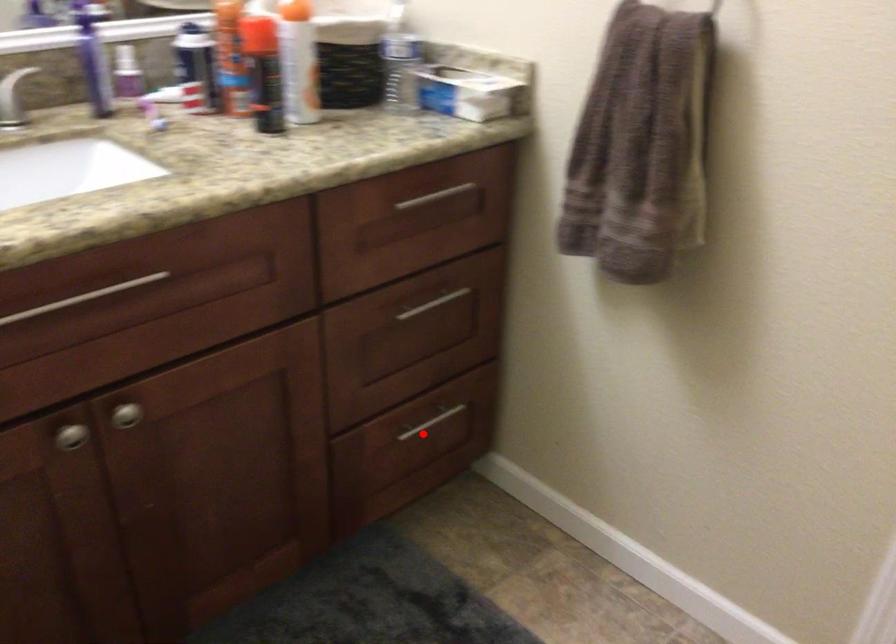
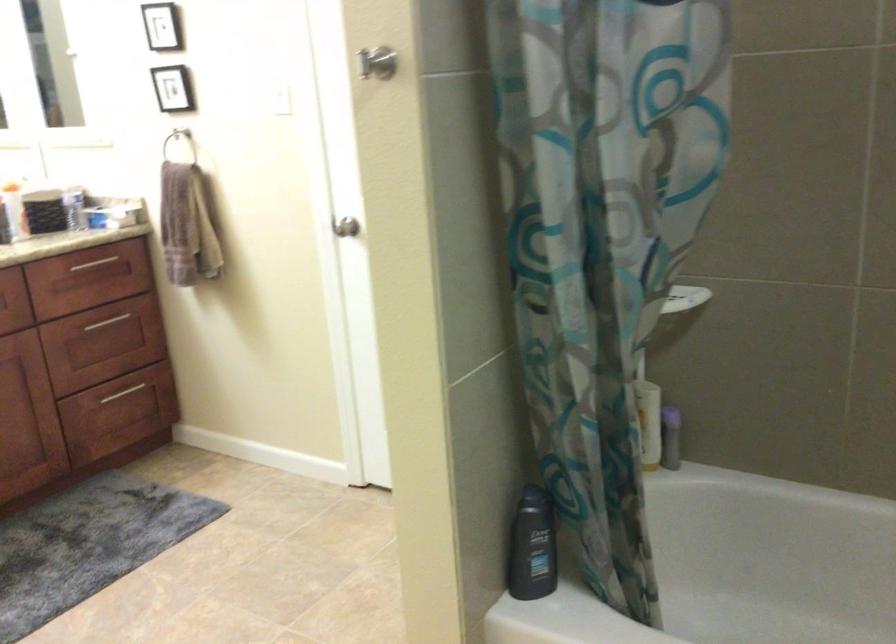
In the second image, find the point that corresponds to the highlighted location in the first image.

(122, 393)